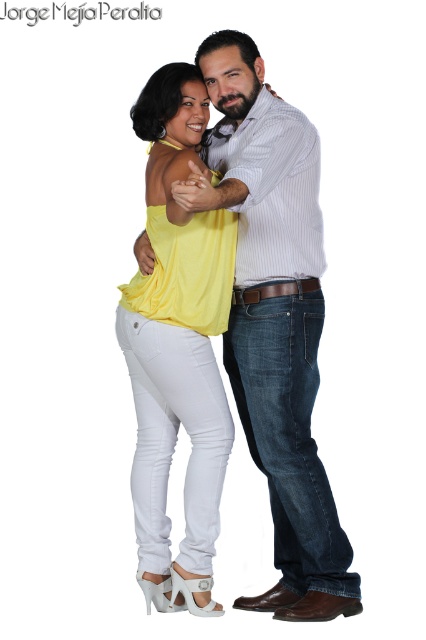
You are organizing a photo shoot and need to ensure that the white matte jeans at center and the matte yellow blouse at center are visible in the final image. Given their sizes, which object will appear larger in the photo?

The white matte jeans at center is much taller than the matte yellow blouse at center, so it will appear larger in the photo.

You are a fashion designer analyzing the image. The scene shows two people standing close, and you need to determine the placement of the white matte jeans at center and the matte yellow blouse at center. Which piece of clothing is positioned higher on the body?

The white matte jeans at center is located above the matte yellow blouse at center, so the white matte jeans at center is positioned higher on the body.